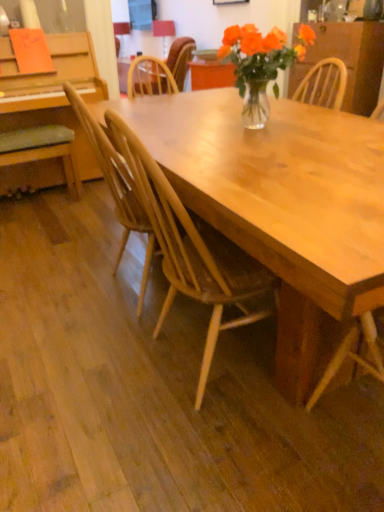
Question: Can you confirm if light brown wood chair at center, the 2th chair positioned from the bottom, is bigger than wooden chair at center, which ranks as the 1th chair in back-to-front order?

Choices:
 (A) no
 (B) yes

Answer: (A)

Question: Can you confirm if light brown wood chair at center, the 2th chair positioned from the bottom, is smaller than wooden chair at center, which ranks as the 1th chair in back-to-front order?

Choices:
 (A) no
 (B) yes

Answer: (B)

Question: Can we say light brown wood chair at center, marked as the 2th chair in a front-to-back arrangement, lies outside wooden chair at center, which ranks as the 1th chair in back-to-front order?

Choices:
 (A) yes
 (B) no

Answer: (A)

Question: Can you confirm if light brown wood chair at center, the 3th chair positioned from the top, is shorter than wooden chair at center, which appears as the 4th chair when viewed from the front?

Choices:
 (A) yes
 (B) no

Answer: (B)

Question: From a real-world perspective, is light brown wood chair at center, marked as the 2th chair in a front-to-back arrangement, physically below wooden chair at center, which appears as the 4th chair when viewed from the front?

Choices:
 (A) no
 (B) yes

Answer: (B)

Question: Looking at their shapes, would you say wooden dresser at upper right is wider or thinner than green fabric cushion at left, which is the 3th chair in bottom-to-top order?

Choices:
 (A) wide
 (B) thin

Answer: (A)

Question: Looking at the image, does wooden dresser at upper right seem bigger or smaller compared to green fabric cushion at left, which is the 3th chair in bottom-to-top order?

Choices:
 (A) big
 (B) small

Answer: (A)

Question: From a real-world perspective, relative to green fabric cushion at left, the 2th chair in the top-to-bottom sequence, is wooden dresser at upper right vertically above or below?

Choices:
 (A) below
 (B) above

Answer: (B)

Question: Considering the positions of wooden dresser at upper right and green fabric cushion at left, positioned as the second chair in back-to-front order, in the image, is wooden dresser at upper right taller or shorter than green fabric cushion at left, positioned as the second chair in back-to-front order,?

Choices:
 (A) short
 (B) tall

Answer: (B)

Question: From a real-world perspective, relative to light brown wood chair at center, which is the 3th chair from back to front, is wooden chair at center, which is the 1th chair from front to back, vertically above or below?

Choices:
 (A) below
 (B) above

Answer: (A)

Question: Is wooden chair at center, arranged as the fourth chair when viewed from the top, inside the boundaries of light brown wood chair at center, marked as the 2th chair in a front-to-back arrangement, or outside?

Choices:
 (A) inside
 (B) outside

Answer: (B)

Question: Is wooden chair at center, arranged as the fourth chair when viewed from the top, wider or thinner than light brown wood chair at center, the 2th chair positioned from the bottom?

Choices:
 (A) wide
 (B) thin

Answer: (A)

Question: Is point (248, 290) closer or farther from the camera than point (144, 290)?

Choices:
 (A) farther
 (B) closer

Answer: (B)

Question: Is point (49, 138) positioned closer to the camera than point (122, 234)?

Choices:
 (A) closer
 (B) farther

Answer: (B)

Question: Considering the relative positions of green fabric cushion at left, which appears as the 3th chair when viewed from the front, and light brown wood chair at center, marked as the 2th chair in a front-to-back arrangement, in the image provided, is green fabric cushion at left, which appears as the 3th chair when viewed from the front, to the left or to the right of light brown wood chair at center, marked as the 2th chair in a front-to-back arrangement,?

Choices:
 (A) left
 (B) right

Answer: (A)